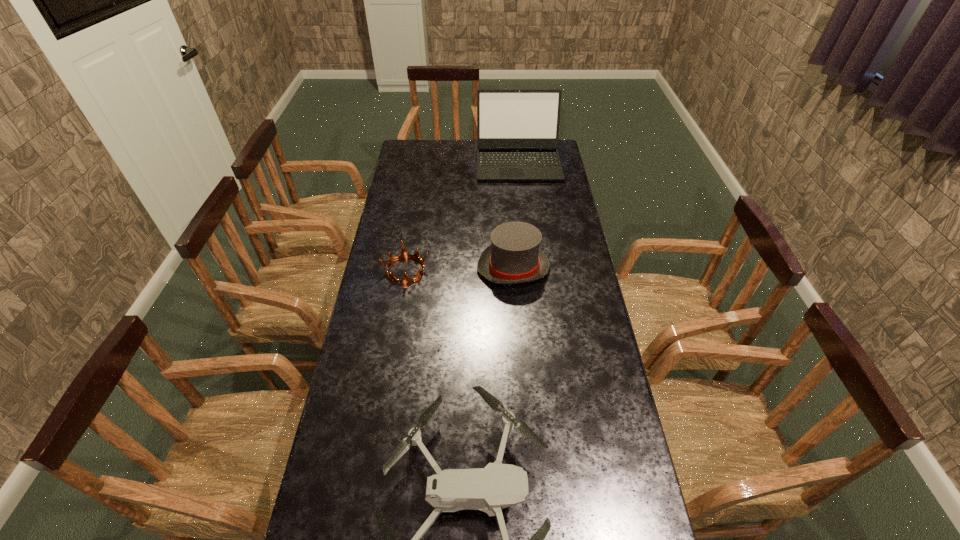
Where is `the tallest object`? the tallest object is located at coordinates point(517,130).

Where is `laptop`? The height and width of the screenshot is (540, 960). laptop is located at coordinates (517, 130).

Locate an element on the screen. The width and height of the screenshot is (960, 540). dress hat is located at coordinates (514, 256).

Find the location of `crown`. crown is located at coordinates (403, 254).

Where is `vacant space positioned 0.350m on the surface of the farthest object`? This screenshot has height=540, width=960. vacant space positioned 0.350m on the surface of the farthest object is located at coordinates (526, 233).

Locate an element on the screen. free location located 0.380m on the front of the third shortest object is located at coordinates click(522, 388).

The width and height of the screenshot is (960, 540). I want to click on vacant space located 0.360m on the front of the shortest object, so click(x=388, y=377).

Where is `object present at the far edge`? object present at the far edge is located at coordinates (517, 130).

Locate an element on the screen. object that is at the left edge is located at coordinates (403, 254).

Find the location of `laptop that is at the right edge`. laptop that is at the right edge is located at coordinates pos(517,130).